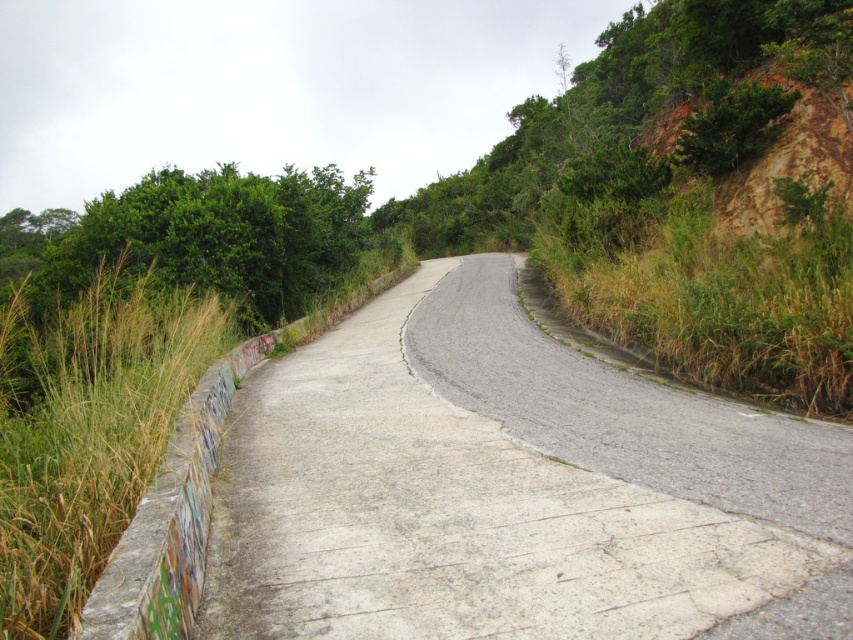
Which is more to the left, green grass at left or dry grass at right?

From the viewer's perspective, green grass at left appears more on the left side.

Is point (28, 554) more distant than point (746, 252)?

No, (28, 554) is closer to viewer.

Does point (61, 545) lie behind point (582, 288)?

No, (61, 545) is closer to viewer.

Where is `green grass at left`? The width and height of the screenshot is (853, 640). green grass at left is located at coordinates (93, 436).

Which is above, gray concrete road at center or green grass at left?

green grass at left

Which is behind, point (514, 400) or point (18, 490)?

The point (514, 400) is more distant.

In order to click on gray concrete road at center in this screenshot , I will do `click(509, 490)`.

You are a GUI agent. You are given a task and a screenshot of the screen. Output one action in this format:
    pyautogui.click(x=<x>, y=<y>)
    Task: Click on the gray concrete road at center
    The width and height of the screenshot is (853, 640).
    Given the screenshot: What is the action you would take?
    pyautogui.click(x=509, y=490)

Is the position of gray concrete road at center less distant than that of dry grass at right?

Yes.

Is point (802, 612) in front of point (677, 202)?

That is True.

Where is `gray concrete road at center`? gray concrete road at center is located at coordinates (509, 490).